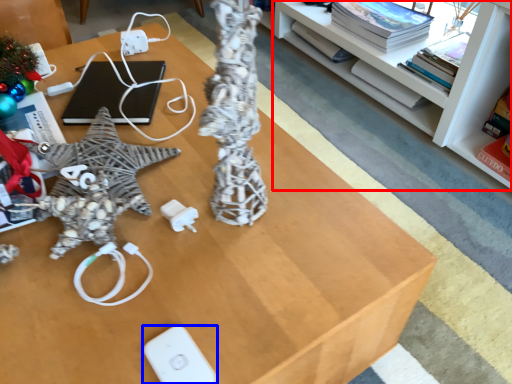
Question: Which point is further to the camera, shelf (highlighted by a red box) or Wii controller (highlighted by a blue box)?

Choices:
 (A) shelf
 (B) Wii controller

Answer: (A)